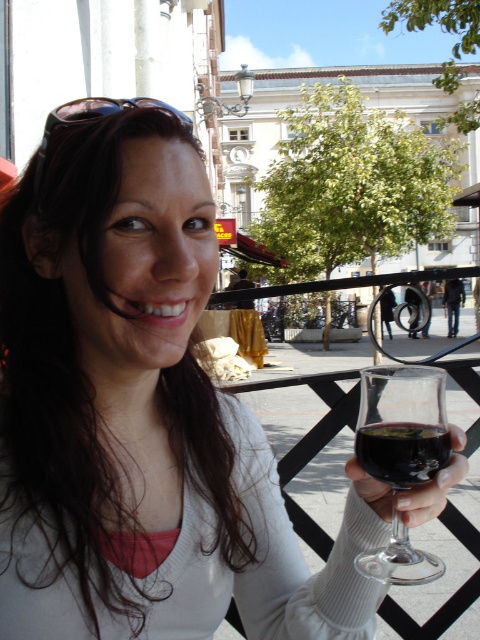
You are a photographer trying to capture the scene from the woman standing at the railing. You want to focus on the transparent glass at lower right and dark red liquid at lower right. Can you clearly see both objects in your shot?

The transparent glass at lower right is 6.98 centimeters away from dark red liquid at lower right, so yes, both objects can be clearly seen in your shot as they are close but distinct.

From the picture: You are a photographer trying to capture the woman holding a glass of red wine in the scene. The transparent glass at lower right is represented by point (402, 424). Where should you position your camera to ensure the transparent glass at lower right is in focus while also capturing the woman clearly?

To focus on the transparent glass at lower right represented by point (402, 424) and capture the woman clearly, position the camera so that the focus point aligns with the coordinates of the transparent glass at lower right. This ensures both the glass and the woman are in the same focal plane, maintaining clarity for both subjects.